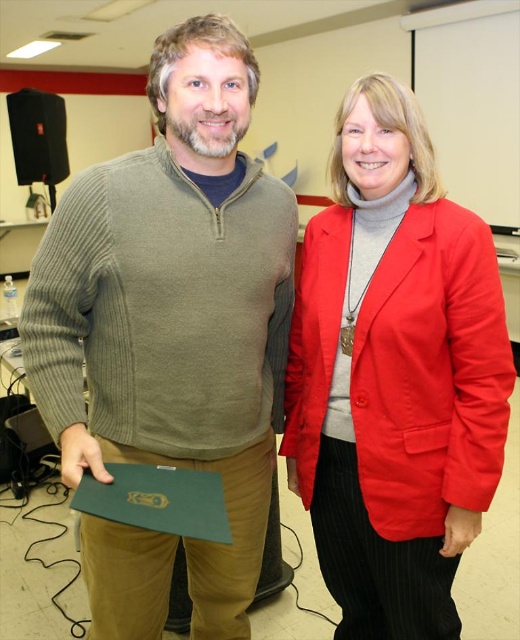
Question: Which of these objects is positioned farthest from the red cotton blazer at center?

Choices:
 (A) green ribbed sweater at left
 (B) green matte folder at lower left

Answer: (B)

Question: Can you confirm if red cotton blazer at center is positioned below green matte folder at lower left?

Choices:
 (A) no
 (B) yes

Answer: (A)

Question: Among these points, which one is nearest to the camera?

Choices:
 (A) (500, 468)
 (B) (242, 83)
 (C) (185, 504)

Answer: (C)

Question: Can you confirm if green ribbed sweater at left is positioned above green matte folder at lower left?

Choices:
 (A) yes
 (B) no

Answer: (A)

Question: Which point is farther to the camera?

Choices:
 (A) red cotton blazer at center
 (B) green ribbed sweater at left

Answer: (A)

Question: Considering the relative positions of green ribbed sweater at left and red cotton blazer at center in the image provided, where is green ribbed sweater at left located with respect to red cotton blazer at center?

Choices:
 (A) right
 (B) left

Answer: (B)